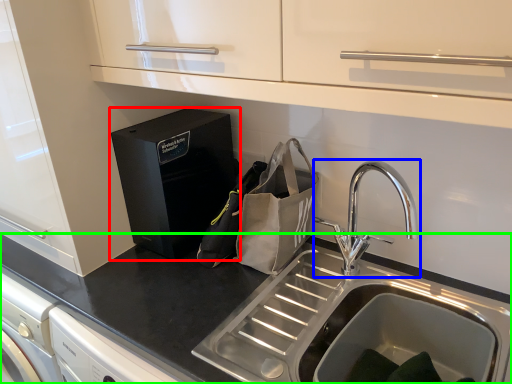
Question: Estimate the real-world distances between objects in this image. Which object is farther from home appliance (highlighted by a red box), tap (highlighted by a blue box) or countertop (highlighted by a green box)?

Choices:
 (A) tap
 (B) countertop

Answer: (A)